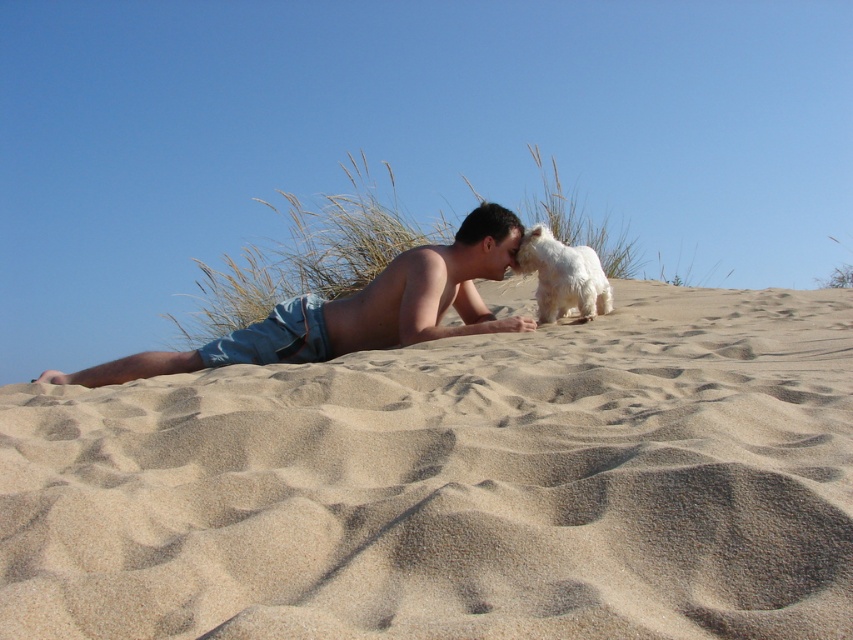
You are a photographer trying to capture the scene with the light beige sand at center and the white fluffy dog at upper center. Since you want the dog to stand out, which object should you focus on to ensure it is in sharp focus while the other becomes slightly blurred?

You should focus on the white fluffy dog at upper center because it is smaller in size than the light beige sand at center, making it easier to isolate and keep in sharp focus while the larger sand area can be blurred for a shallower depth of field.

You are a photographer trying to capture the scene where the man and dog are interacting. You need to position your camera so that both the light beige sand at center and the light blue denim shorts at center are visible. Which object should you focus on first if you want to ensure both are in frame?

The light beige sand at center is not as tall as the light blue denim shorts at center, so you should focus on the light blue denim shorts at center first to ensure both are in frame.